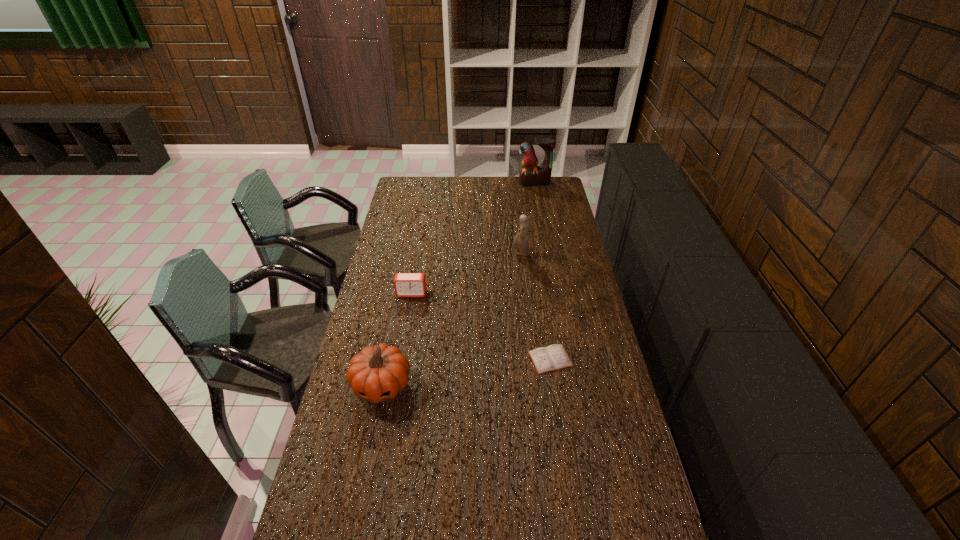
Identify the location of object situated at the far right corner. This screenshot has width=960, height=540. (531, 175).

You are a GUI agent. You are given a task and a screenshot of the screen. Output one action in this format:
    pyautogui.click(x=<x>, y=<y>)
    Task: Click on the free space at the far edge of the desktop
    This screenshot has width=960, height=540.
    Given the screenshot: What is the action you would take?
    pyautogui.click(x=500, y=184)

In the image, there is a desktop. In order to click on vacant region at the left edge in this screenshot , I will do `click(420, 228)`.

Where is `free space at the right edge`? free space at the right edge is located at coordinates (566, 286).

At what (x,y) coordinates should I click in order to perform the action: click on vacant region at the far left corner. Please return your answer as a coordinate pair (x, y). The width and height of the screenshot is (960, 540). Looking at the image, I should click on (408, 179).

Image resolution: width=960 pixels, height=540 pixels. In order to click on vacant area that lies between the farthest object and the shortest object in this screenshot , I will do `click(542, 271)`.

Locate an element on the screen. empty space between the third farthest object and the parrot is located at coordinates (473, 238).

Where is `empty space that is in between the second farthest object and the pumpkin`? This screenshot has height=540, width=960. empty space that is in between the second farthest object and the pumpkin is located at coordinates (451, 319).

Identify the location of vacant area between the tallest object and the shortest object. The width and height of the screenshot is (960, 540). (542, 271).

The height and width of the screenshot is (540, 960). I want to click on free space between the parrot and the second shortest object, so click(x=473, y=238).